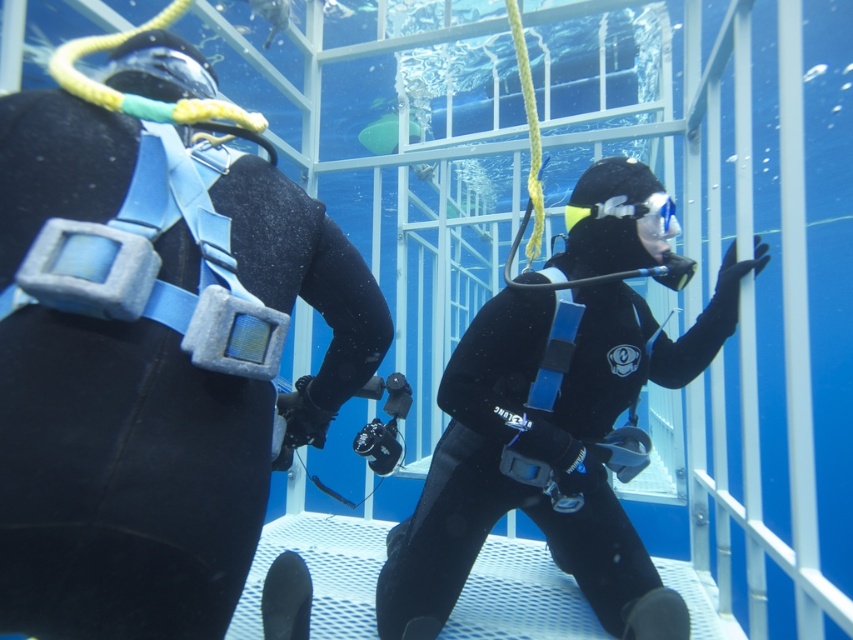
Can you confirm if black matte wetsuit at left is positioned below black matte wetsuit at center?

No.

Can you confirm if black matte wetsuit at left is positioned to the left of black matte wetsuit at center?

Correct, you'll find black matte wetsuit at left to the left of black matte wetsuit at center.

Describe the element at coordinates (166, 424) in the screenshot. I see `black matte wetsuit at left` at that location.

What are the coordinates of `black matte wetsuit at left` in the screenshot? It's located at (166, 424).

Can you confirm if black matte wetsuit at left is bigger than clear plastic goggles at center?

Indeed, black matte wetsuit at left has a larger size compared to clear plastic goggles at center.

Is point (115, 438) positioned in front of point (575, 214)?

Yes, point (115, 438) is in front of point (575, 214).

This screenshot has height=640, width=853. I want to click on black matte wetsuit at left, so click(x=166, y=424).

Which is behind, point (669, 378) or point (654, 230)?

The point (669, 378) is behind.

Identify the location of black matte wetsuit at center. The width and height of the screenshot is (853, 640). (547, 451).